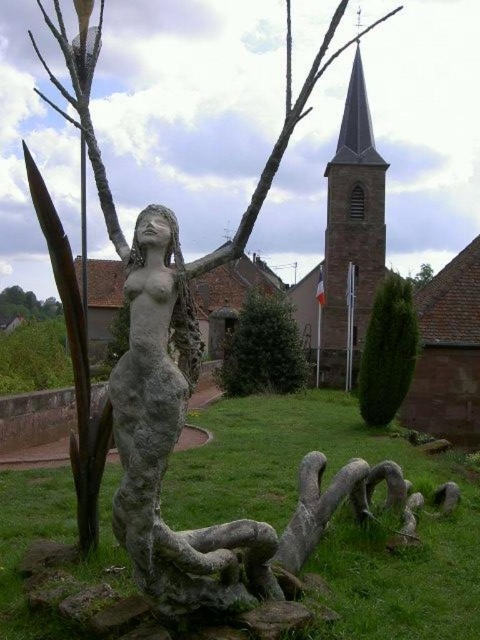
Question: Can you confirm if green grass at center is smaller than gray stone statue at center?

Choices:
 (A) no
 (B) yes

Answer: (A)

Question: Which of these objects is positioned closest to the green leafy tree at upper left?

Choices:
 (A) green textured tree at center right
 (B) green leafy bush at center

Answer: (B)

Question: Which point is closer to the camera?

Choices:
 (A) gray stone statue at center
 (B) green leafy tree at upper left
 (C) green textured tree at center right

Answer: (A)

Question: Which point is farther to the camera?

Choices:
 (A) green leafy tree at upper left
 (B) gray stone statue at center
 (C) green textured tree at center right
 (D) green leafy bush at center

Answer: (A)

Question: Does green leafy bush at center have a greater width compared to green textured tree at center right?

Choices:
 (A) no
 (B) yes

Answer: (B)

Question: Is green leafy bush at center closer to the viewer compared to green leafy tree at upper left?

Choices:
 (A) yes
 (B) no

Answer: (A)